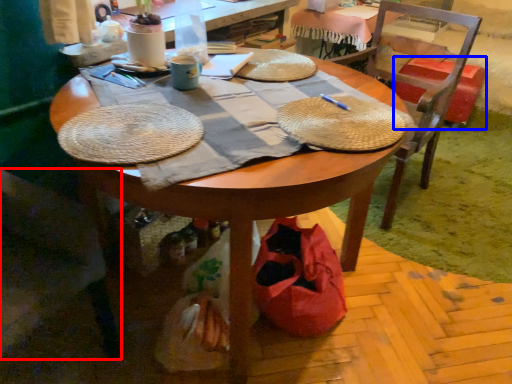
Question: Which object appears closest to the camera in this image, chair (highlighted by a red box) or trash bin/can (highlighted by a blue box)?

Choices:
 (A) chair
 (B) trash bin/can

Answer: (A)